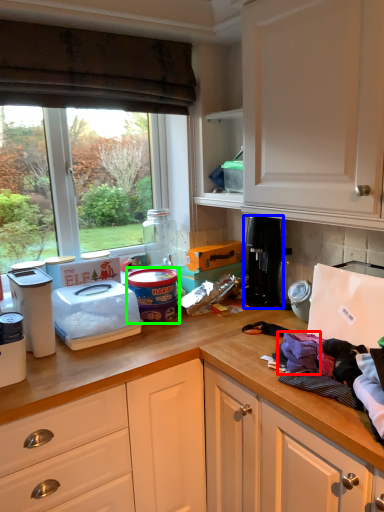
Question: Which is farther away from clothing (highlighted by a red box)? coffee machine (highlighted by a blue box) or appliance (highlighted by a green box)?

Choices:
 (A) coffee machine
 (B) appliance

Answer: (B)